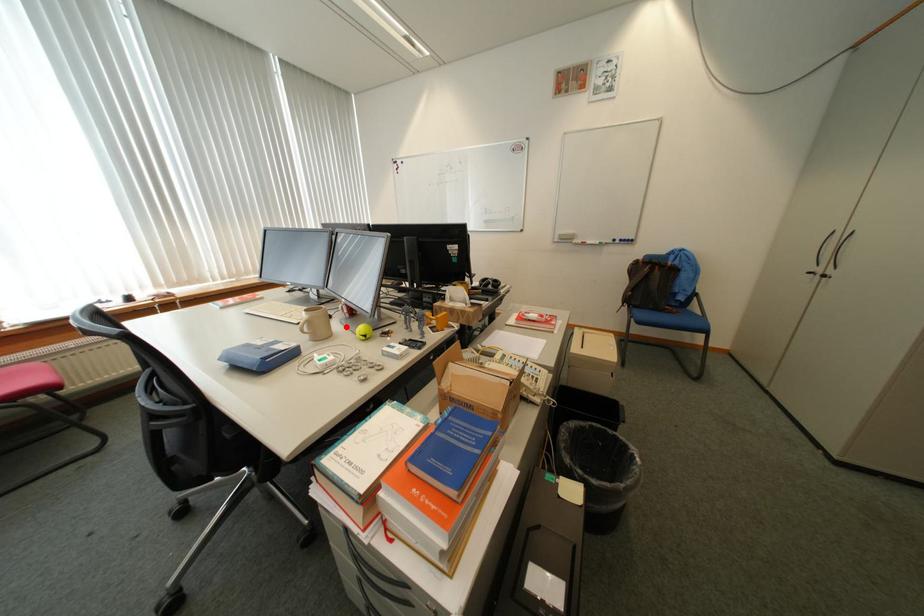
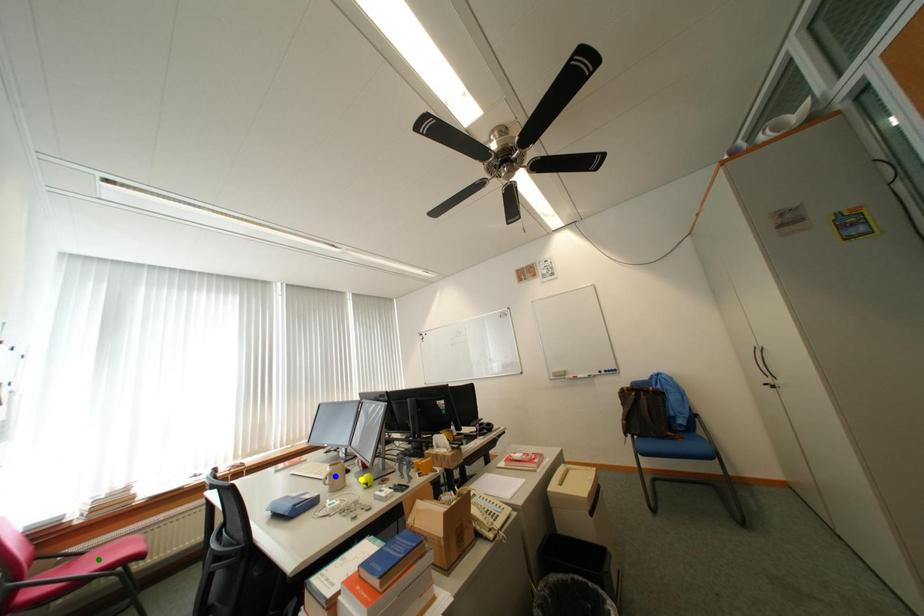
Question: I am providing you with two images of the same scene from different viewpoints. A red point is marked on the first image. You are given multiple points on the second image. In image 2, which mark is for the same physical point as the one in image 1?

Choices:
 (A) blue point
 (B) yellow point
 (C) green point

Answer: (B)